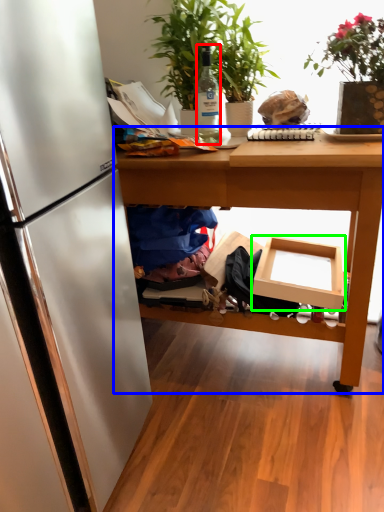
Question: Considering the real-world distances, which object is farthest from bottle (highlighted by a red box)? table (highlighted by a blue box) or cardboard box (highlighted by a green box)?

Choices:
 (A) table
 (B) cardboard box

Answer: (B)